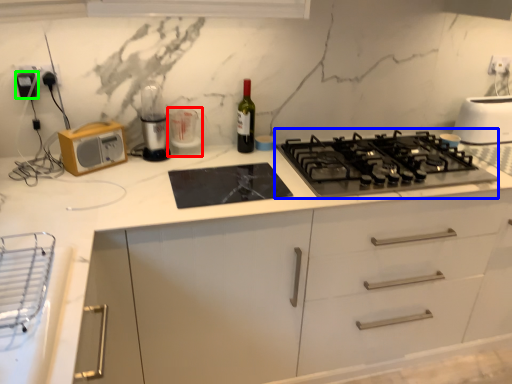
Question: Which object is positioned farthest from appliance (highlighted by a red box)? Select from gas stove (highlighted by a blue box) and appliance (highlighted by a green box).

Choices:
 (A) gas stove
 (B) appliance

Answer: (A)